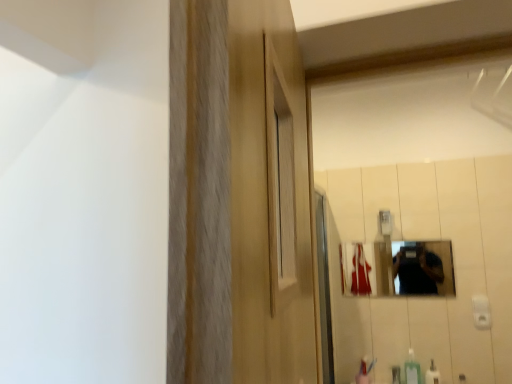
Question: Is white glossy bottle at lower right positioned far away from metallic reflective mirror at center?

Choices:
 (A) no
 (B) yes

Answer: (A)

Question: Is the position of white glossy bottle at lower right less distant than that of metallic reflective mirror at center?

Choices:
 (A) no
 (B) yes

Answer: (B)

Question: Can you confirm if white glossy bottle at lower right is bigger than metallic reflective mirror at center?

Choices:
 (A) yes
 (B) no

Answer: (B)

Question: Does white glossy bottle at lower right have a lesser height compared to metallic reflective mirror at center?

Choices:
 (A) yes
 (B) no

Answer: (A)

Question: From a real-world perspective, is white glossy bottle at lower right physically above metallic reflective mirror at center?

Choices:
 (A) no
 (B) yes

Answer: (A)

Question: Does point (410, 380) appear closer or farther from the camera than point (415, 261)?

Choices:
 (A) farther
 (B) closer

Answer: (B)

Question: Is green plastic soap dispenser at lower right inside or outside of metallic reflective mirror at center?

Choices:
 (A) outside
 (B) inside

Answer: (A)

Question: In terms of width, does green plastic soap dispenser at lower right look wider or thinner when compared to metallic reflective mirror at center?

Choices:
 (A) thin
 (B) wide

Answer: (B)

Question: From a real-world perspective, relative to metallic reflective mirror at center, is green plastic soap dispenser at lower right vertically above or below?

Choices:
 (A) above
 (B) below

Answer: (B)

Question: Considering the positions of metallic reflective mirror at center and green plastic soap dispenser at lower right in the image, is metallic reflective mirror at center bigger or smaller than green plastic soap dispenser at lower right?

Choices:
 (A) big
 (B) small

Answer: (A)

Question: From the image's perspective, relative to green plastic soap dispenser at lower right, is metallic reflective mirror at center above or below?

Choices:
 (A) below
 (B) above

Answer: (B)

Question: Considering the positions of metallic reflective mirror at center and green plastic soap dispenser at lower right in the image, is metallic reflective mirror at center wider or thinner than green plastic soap dispenser at lower right?

Choices:
 (A) thin
 (B) wide

Answer: (A)

Question: In the image, is metallic reflective mirror at center on the left side or the right side of green plastic soap dispenser at lower right?

Choices:
 (A) left
 (B) right

Answer: (A)

Question: From a real-world perspective, relative to white glossy bottle at lower right, is metallic reflective mirror at center vertically above or below?

Choices:
 (A) below
 (B) above

Answer: (B)

Question: From their relative heights in the image, would you say metallic reflective mirror at center is taller or shorter than white glossy bottle at lower right?

Choices:
 (A) tall
 (B) short

Answer: (A)